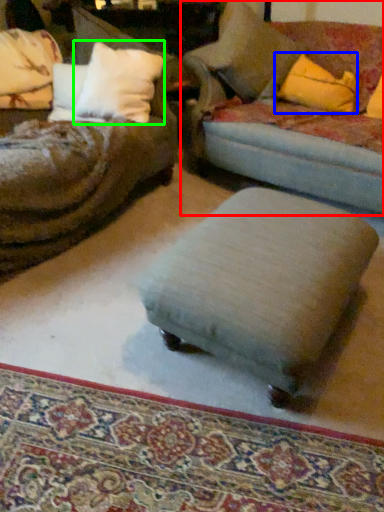
Question: Based on their relative distances, which object is farther from studio couch (highlighted by a red box)? Choose from throw pillow (highlighted by a blue box) and pillow (highlighted by a green box).

Choices:
 (A) throw pillow
 (B) pillow

Answer: (B)